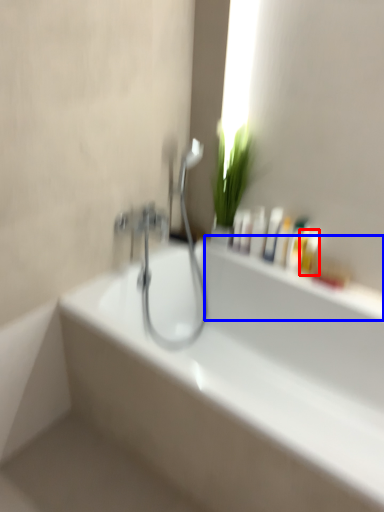
Question: Which of the following is the closest to the observer, mouthwash (highlighted by a red box) or window sill (highlighted by a blue box)?

Choices:
 (A) mouthwash
 (B) window sill

Answer: (B)